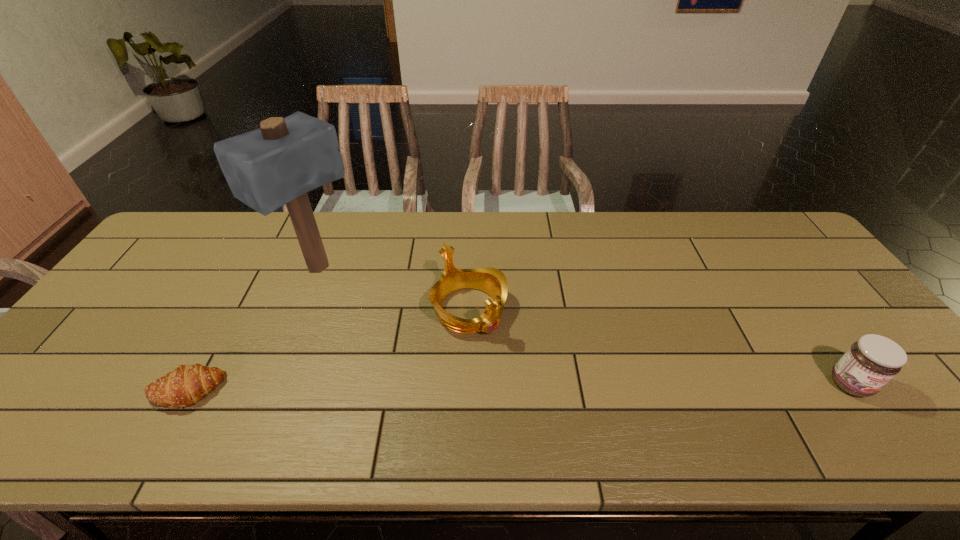
Image resolution: width=960 pixels, height=540 pixels. In order to click on the shortest object in this screenshot , I will do `click(184, 386)`.

Locate an element on the screen. The image size is (960, 540). the rightmost object is located at coordinates (870, 363).

Where is `mallet`? The image size is (960, 540). mallet is located at coordinates (277, 164).

At what (x,y) coordinates should I click in order to perform the action: click on the third object from left to right. Please return your answer as a coordinate pair (x, y). The height and width of the screenshot is (540, 960). Looking at the image, I should click on [492, 281].

Where is `vacant position located on the right of the crescent roll`? The height and width of the screenshot is (540, 960). vacant position located on the right of the crescent roll is located at coordinates (277, 391).

What are the coordinates of `blank area located on the striking surface of the tallest object` in the screenshot? It's located at (432, 348).

The height and width of the screenshot is (540, 960). I want to click on free spot located on the striking surface of the tallest object, so click(x=392, y=320).

What are the coordinates of `vacant area situated 0.100m on the striking surface of the tallest object` in the screenshot? It's located at (369, 305).

The image size is (960, 540). Identify the location of blank space located at the front emblem of the tiara. (511, 361).

Where is `free region located at the front emblem of the tiara`? This screenshot has width=960, height=540. free region located at the front emblem of the tiara is located at coordinates (536, 391).